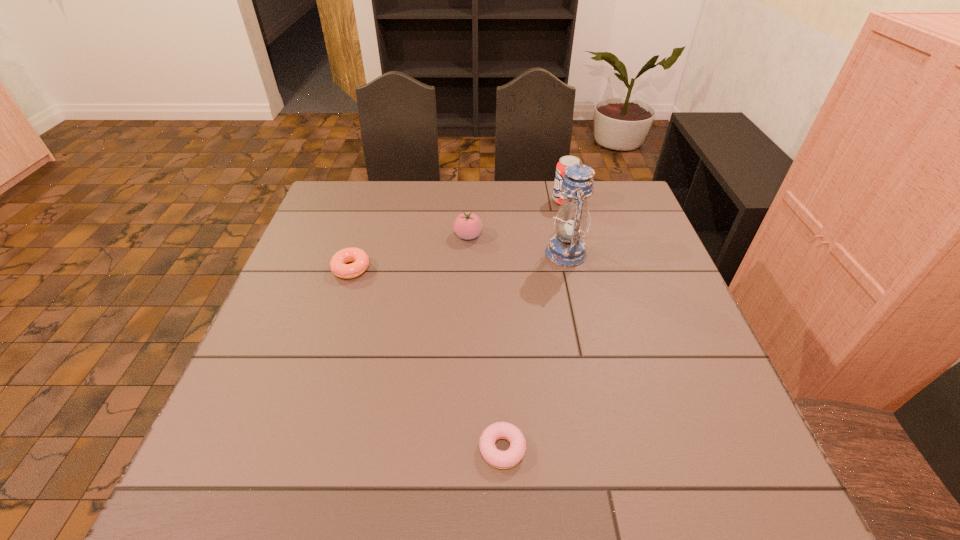
The height and width of the screenshot is (540, 960). I want to click on free space located on the front-facing side of the tallest object, so click(x=401, y=253).

Image resolution: width=960 pixels, height=540 pixels. In order to click on vacant space located on the surface of the farthest object in this screenshot , I will do `click(487, 201)`.

The image size is (960, 540). Identify the location of blank area located on the surface of the farthest object. (499, 201).

Find the location of a particular element. This screenshot has height=540, width=960. vacant space located 0.230m on the surface of the farthest object is located at coordinates (481, 201).

Where is `vacant space located on the front of the third shortest object`? vacant space located on the front of the third shortest object is located at coordinates (466, 322).

Image resolution: width=960 pixels, height=540 pixels. I want to click on free space located on the right of the taller doughnut, so click(x=456, y=269).

Identify the location of free space located 0.180m on the left of the right doughnut. This screenshot has height=540, width=960. (381, 449).

Locate an element on the screen. Image resolution: width=960 pixels, height=540 pixels. object that is at the far edge is located at coordinates (564, 161).

You are a GUI agent. You are given a task and a screenshot of the screen. Output one action in this format:
    pyautogui.click(x=<x>, y=<y>)
    Task: Click on the object at the near edge
    The height and width of the screenshot is (540, 960).
    Given the screenshot: What is the action you would take?
    pyautogui.click(x=511, y=457)

The image size is (960, 540). What are the coordinates of `object that is at the left edge` in the screenshot? It's located at (339, 267).